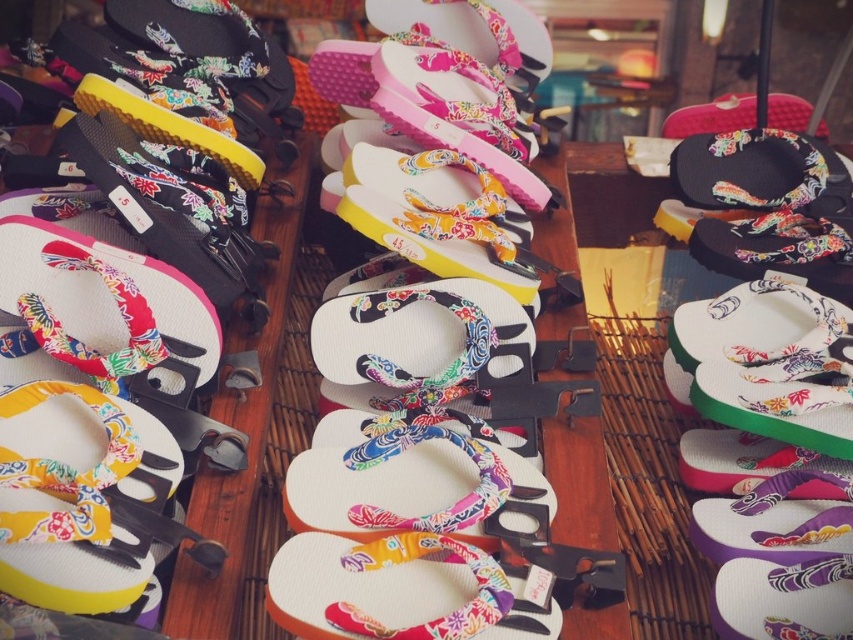
Question: Is matte floral flip-flop at center wider than matte floral flip-flop at left?

Choices:
 (A) yes
 (B) no

Answer: (B)

Question: Is matte floral flip-flop at center in front of matte floral flip-flop at left?

Choices:
 (A) no
 (B) yes

Answer: (A)

Question: Can you confirm if matte floral flip-flop at center is bigger than matte floral flip-flop at left?

Choices:
 (A) yes
 (B) no

Answer: (B)